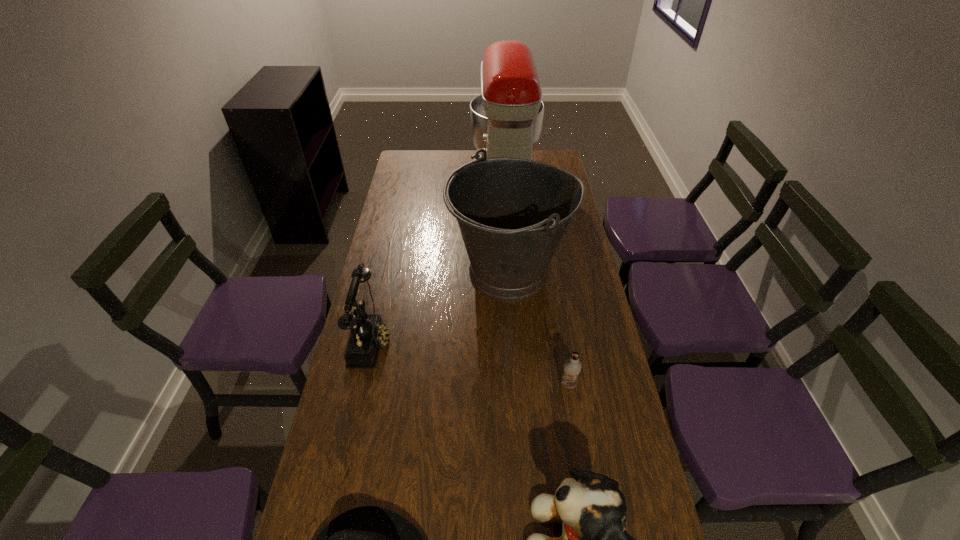
The height and width of the screenshot is (540, 960). I want to click on free spot located on the dial of the telephone, so click(x=413, y=339).

Identify the location of blank space located 0.270m on the front of the second shortest object. The image size is (960, 540). (587, 492).

This screenshot has height=540, width=960. I want to click on object located at the far edge, so click(506, 120).

Where is `object that is at the left edge`? The width and height of the screenshot is (960, 540). object that is at the left edge is located at coordinates (368, 333).

Locate an element on the screen. mixer located in the right edge section of the desktop is located at coordinates (506, 120).

You are a GUI agent. You are given a task and a screenshot of the screen. Output one action in this format:
    pyautogui.click(x=<x>, y=<y>)
    Task: Click on the bucket that is at the right edge
    This screenshot has width=960, height=540.
    Given the screenshot: What is the action you would take?
    pyautogui.click(x=512, y=213)

Where is `chocolate milk that is positioned at the right edge`? This screenshot has height=540, width=960. chocolate milk that is positioned at the right edge is located at coordinates (572, 366).

You are a GUI agent. You are given a task and a screenshot of the screen. Output one action in this format:
    pyautogui.click(x=<x>, y=<y>)
    Task: Click on the object that is at the far right corner
    The height and width of the screenshot is (540, 960).
    Given the screenshot: What is the action you would take?
    pyautogui.click(x=506, y=120)

Find the location of a particular element. free space at the far edge of the desktop is located at coordinates (454, 171).

Find the location of `vacant area at the left edge of the desktop`. vacant area at the left edge of the desktop is located at coordinates (404, 179).